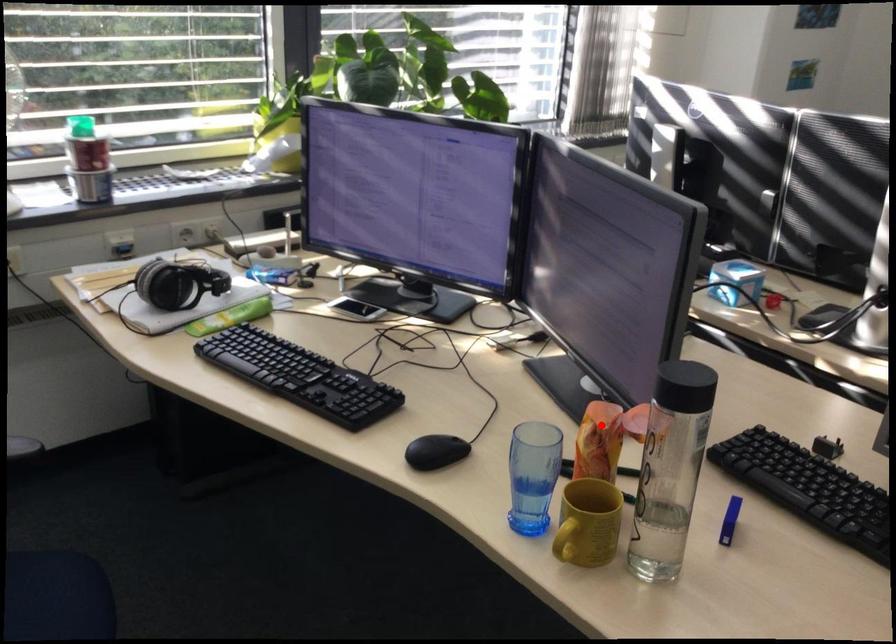
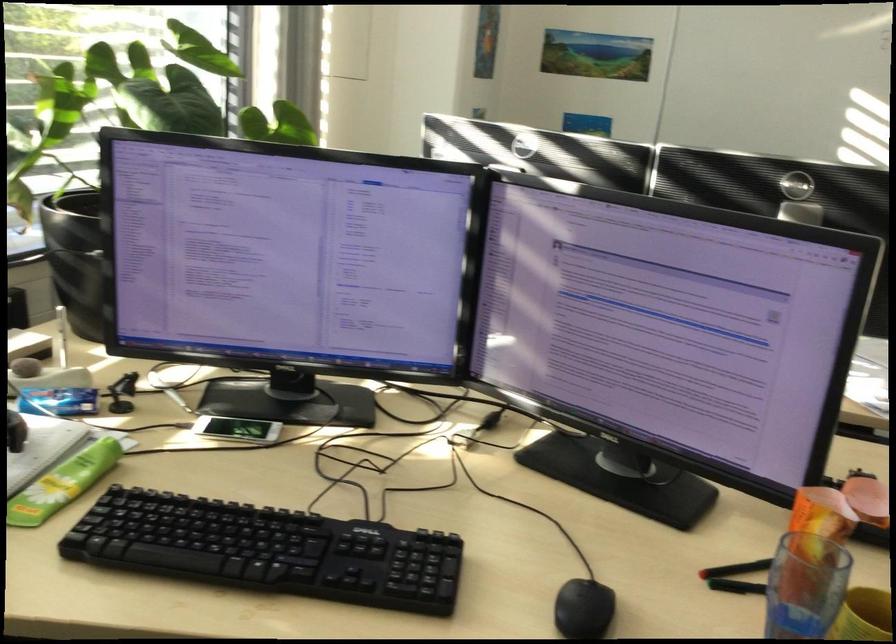
Find the pixel in the second image that matches the highlighted location in the first image.

(822, 514)